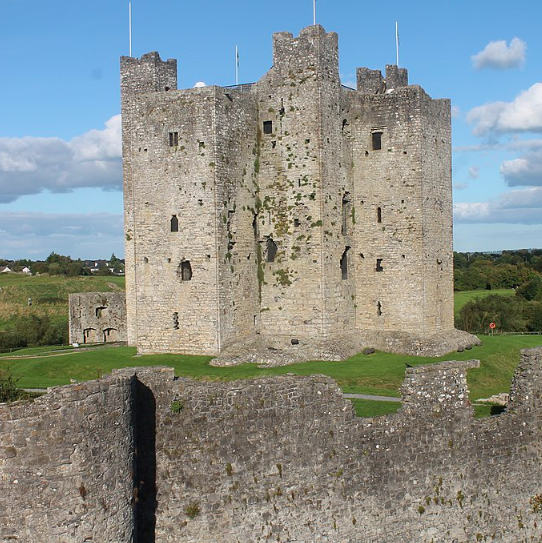
Locate an element on the screen. The width and height of the screenshot is (542, 543). homes is located at coordinates (5, 268), (25, 268), (90, 272), (114, 271).